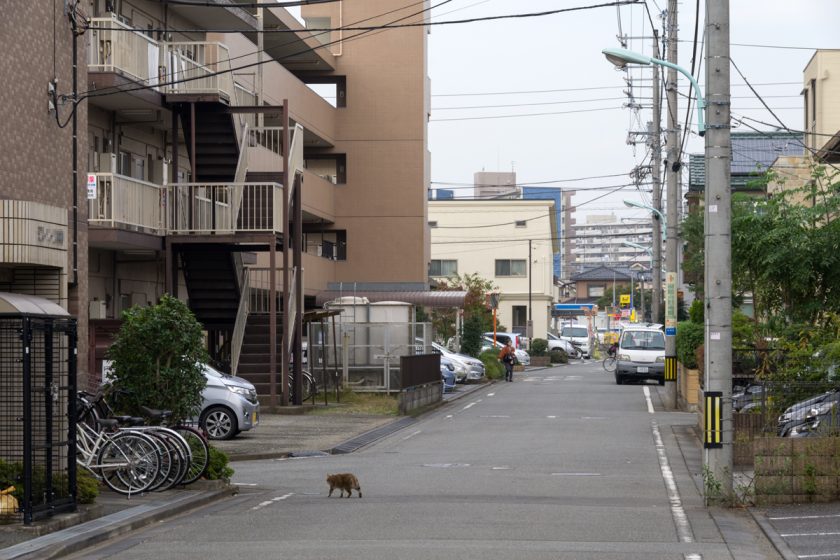
Find the location of a particular element. stairs is located at coordinates (276, 166).